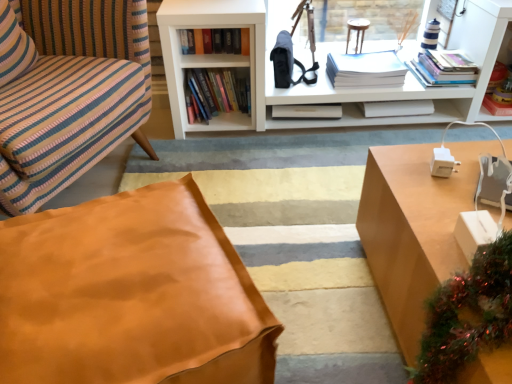
What do you see at coordinates (443, 69) in the screenshot?
I see `hardcover books at upper right, placed as the 1th book when sorted from right to left` at bounding box center [443, 69].

What is the approximate width of hardcover books at upper right, which ranks as the 5th book in left-to-right order?

hardcover books at upper right, which ranks as the 5th book in left-to-right order, is 30.37 centimeters wide.

Where is `hardcover books at center, the 4th book from the right`? The image size is (512, 384). hardcover books at center, the 4th book from the right is located at coordinates (218, 92).

What is the approximate width of light brown wood desk at right?

71.12 centimeters.

Describe the element at coordinates (14, 46) in the screenshot. Image resolution: width=512 pixels, height=384 pixels. I see `striped fabric pillow at left` at that location.

What do you see at coordinates (130, 295) in the screenshot?
I see `leather ottoman at center` at bounding box center [130, 295].

Find the location of a particular element. This screenshot has width=512, height=384. hardcover book at upper center, marked as the 5th book in a right-to-left arrangement is located at coordinates (215, 41).

Identify the location of white matte book at center, the fourth book from the left. (397, 108).

The width and height of the screenshot is (512, 384). What are the coordinates of `hardcover books at upper right, placed as the 1th book when sorted from right to left` in the screenshot? It's located at (443, 69).

From the image's perspective, does hardcover book at upper center, which appears as the first book when viewed from the left, appear lower than leather ottoman at center?

No.

Between hardcover book at upper center, which appears as the first book when viewed from the left, and leather ottoman at center, which one has less height?

Standing shorter between the two is hardcover book at upper center, which appears as the first book when viewed from the left.

Is hardcover book at upper center, marked as the 5th book in a right-to-left arrangement, positioned beyond the bounds of leather ottoman at center?

Absolutely, hardcover book at upper center, marked as the 5th book in a right-to-left arrangement, is external to leather ottoman at center.

Can hardcover book at upper center, marked as the 5th book in a right-to-left arrangement, be found inside hardcover books at upper right, which ranks as the 5th book in left-to-right order?

That's incorrect, hardcover book at upper center, marked as the 5th book in a right-to-left arrangement, is not inside hardcover books at upper right, which ranks as the 5th book in left-to-right order.

Measure the distance between hardcover books at upper right, placed as the 1th book when sorted from right to left, and hardcover book at upper center, which appears as the first book when viewed from the left.

33.87 inches.

Is hardcover books at upper right, which ranks as the 5th book in left-to-right order, with hardcover book at upper center, which appears as the first book when viewed from the left?

There is a gap between hardcover books at upper right, which ranks as the 5th book in left-to-right order, and hardcover book at upper center, which appears as the first book when viewed from the left.

Identify the location of book that is the 4th one when counting leftward from the hardcover books at upper right, placed as the 1th book when sorted from right to left. (215, 41).

In terms of size, does hardcover book at upper center, marked as the 5th book in a right-to-left arrangement, appear bigger or smaller than light brown wood desk at right?

hardcover book at upper center, marked as the 5th book in a right-to-left arrangement, is smaller than light brown wood desk at right.

Is hardcover book at upper center, marked as the 5th book in a right-to-left arrangement, not close to light brown wood desk at right?

hardcover book at upper center, marked as the 5th book in a right-to-left arrangement, is positioned a significant distance from light brown wood desk at right.

From the image's perspective, which one is positioned lower, hardcover book at upper center, which appears as the first book when viewed from the left, or light brown wood desk at right?

light brown wood desk at right appears lower in the image.

Find the location of `desk that appears on the right of hardcover book at upper center, which appears as the first book when viewed from the left`. desk that appears on the right of hardcover book at upper center, which appears as the first book when viewed from the left is located at coordinates (414, 228).

Is leather ottoman at center wider or thinner than striped fabric pillow at left?

Considering their sizes, leather ottoman at center looks broader than striped fabric pillow at left.

Is leather ottoman at center next to striped fabric pillow at left and touching it?

No, leather ottoman at center is not touching striped fabric pillow at left.

Consider the image. Which object is further away from the camera taking this photo, leather ottoman at center or striped fabric pillow at left?

striped fabric pillow at left is more distant.

Is leather ottoman at center looking in the opposite direction of striped fabric pillow at left?

No, leather ottoman at center is not facing away from striped fabric pillow at left.

Would you say hardcover books at center, the 4th book from the right, is outside light brown wood desk at right?

Yes, hardcover books at center, the 4th book from the right, is outside of light brown wood desk at right.

At what (x,y) coordinates should I click in order to perform the action: click on desk in front of the hardcover books at center, the 4th book from the right. Please return your answer as a coordinate pair (x, y). The image size is (512, 384). Looking at the image, I should click on (414, 228).

Is hardcover books at center, which is counted as the second book, starting from the left, facing away from light brown wood desk at right?

No, hardcover books at center, which is counted as the second book, starting from the left,'s orientation is not away from light brown wood desk at right.

Considering the positions of objects hardcover books at center, the 4th book from the right, and light brown wood desk at right in the image provided, who is more to the right, hardcover books at center, the 4th book from the right, or light brown wood desk at right?

From the viewer's perspective, light brown wood desk at right appears more on the right side.

Does white paper stack at upper center, which ranks as the 3th book in left-to-right order, have a greater width compared to hardcover books at upper right, placed as the 1th book when sorted from right to left?

No, white paper stack at upper center, which ranks as the 3th book in left-to-right order, is not wider than hardcover books at upper right, placed as the 1th book when sorted from right to left.

Considering the positions of point (398, 84) and point (436, 74), is point (398, 84) closer or farther from the camera than point (436, 74)?

Point (398, 84) appears to be farther away from the viewer than point (436, 74).

Between white paper stack at upper center, the third book positioned from the right, and hardcover books at upper right, which ranks as the 5th book in left-to-right order, which one is positioned behind?

Positioned behind is white paper stack at upper center, the third book positioned from the right.

Based on the photo, how far apart are white paper stack at upper center, which ranks as the 3th book in left-to-right order, and hardcover books at upper right, placed as the 1th book when sorted from right to left?

The distance of white paper stack at upper center, which ranks as the 3th book in left-to-right order, from hardcover books at upper right, placed as the 1th book when sorted from right to left, is 21.38 centimeters.

From the image's perspective, is light brown wood desk at right on white matte book at center, marked as the second book in a right-to-left arrangement?

No, from the image's perspective, light brown wood desk at right is not on top of white matte book at center, marked as the second book in a right-to-left arrangement.

Considering the relative sizes of light brown wood desk at right and white matte book at center, the fourth book from the left, in the image provided, is light brown wood desk at right taller than white matte book at center, the fourth book from the left,?

Yes.

Where is `the 3rd book above the leather ottoman at center (from a real-world perspective)`? This screenshot has height=384, width=512. the 3rd book above the leather ottoman at center (from a real-world perspective) is located at coordinates (215, 41).

From the image's perspective, starting from the hardcover book at upper center, which appears as the first book when viewed from the left, which book is the 1st one below? Please provide its 2D coordinates.

[(443, 69)]

When comparing their distances from white matte bookcase at upper center, does leather at lower left or white matte book at center, the fourth book from the left, seem further?

leather at lower left lies further to white matte bookcase at upper center than the other object.

Which object lies further to the anchor point hardcover books at upper right, which ranks as the 5th book in left-to-right order, white matte bookcase at upper center or leather ottoman at center?

leather ottoman at center lies further to hardcover books at upper right, which ranks as the 5th book in left-to-right order, than the other object.

Considering their positions, is white paper stack at upper center, which ranks as the 3th book in left-to-right order, positioned further to hardcover book at upper center, which appears as the first book when viewed from the left, than hardcover books at center, which is counted as the second book, starting from the left?

Among the two, white paper stack at upper center, which ranks as the 3th book in left-to-right order, is located further to hardcover book at upper center, which appears as the first book when viewed from the left.

Looking at the image, which one is located further to leather at lower left, white paper stack at upper center, which ranks as the 3th book in left-to-right order, or white matte book at center, marked as the second book in a right-to-left arrangement?

white matte book at center, marked as the second book in a right-to-left arrangement, is further to leather at lower left.

From the image, which object appears to be nearer to white matte bookcase at upper center, white matte book at center, marked as the second book in a right-to-left arrangement, or leather at lower left?

Among the two, white matte book at center, marked as the second book in a right-to-left arrangement, is located nearer to white matte bookcase at upper center.

Based on their spatial positions, is leather at lower left or hardcover book at upper center, marked as the 5th book in a right-to-left arrangement, closer to light brown wood desk at right?

The object closer to light brown wood desk at right is leather at lower left.

From the image, which object appears to be farther from hardcover book at upper center, which appears as the first book when viewed from the left, hardcover books at upper right, which ranks as the 5th book in left-to-right order, or striped fabric pillow at left?

hardcover books at upper right, which ranks as the 5th book in left-to-right order, is positioned further to the anchor hardcover book at upper center, which appears as the first book when viewed from the left.

From the image, which object appears to be nearer to striped fabric pillow at left, white paper stack at upper center, which ranks as the 3th book in left-to-right order, or leather ottoman at center?

leather ottoman at center is positioned closer to the anchor striped fabric pillow at left.

Image resolution: width=512 pixels, height=384 pixels. Find the location of `bookcase between light brown wood desk at right and hardcover book at upper center, which appears as the first book when viewed from the left, along the z-axis`. bookcase between light brown wood desk at right and hardcover book at upper center, which appears as the first book when viewed from the left, along the z-axis is located at coordinates (320, 66).

Where is `chair positioned between leather ottoman at center and hardcover book at upper center, marked as the 5th book in a right-to-left arrangement, from near to far`? chair positioned between leather ottoman at center and hardcover book at upper center, marked as the 5th book in a right-to-left arrangement, from near to far is located at coordinates (72, 96).

I want to click on desk located between leather ottoman at center and hardcover books at upper right, which ranks as the 5th book in left-to-right order, in the depth direction, so click(414, 228).

Image resolution: width=512 pixels, height=384 pixels. I want to click on bookcase positioned between leather ottoman at center and white matte book at center, marked as the second book in a right-to-left arrangement, from near to far, so click(x=320, y=66).